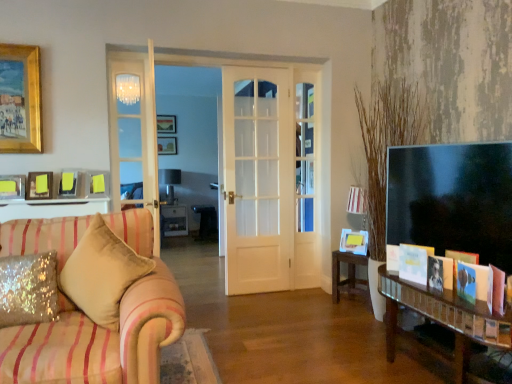
Question: Does matte gold picture frame at upper left, marked as the first picture frame in a front-to-back arrangement, lie behind yellow paper at right, which appears as the 1th picture frame when viewed from the right?

Choices:
 (A) yes
 (B) no

Answer: (B)

Question: Is matte gold picture frame at upper left, which is the first picture frame from left to right, oriented away from yellow paper at right, which is counted as the 1th picture frame, starting from the bottom?

Choices:
 (A) no
 (B) yes

Answer: (A)

Question: Does matte gold picture frame at upper left, which is the first picture frame from left to right, appear on the right side of yellow paper at right, which is counted as the 1th picture frame, starting from the bottom?

Choices:
 (A) yes
 (B) no

Answer: (B)

Question: Considering the relative sizes of matte gold picture frame at upper left, acting as the 6th picture frame starting from the back, and yellow paper at right, which appears as the 1th picture frame when viewed from the right, in the image provided, is matte gold picture frame at upper left, acting as the 6th picture frame starting from the back, shorter than yellow paper at right, which appears as the 1th picture frame when viewed from the right,?

Choices:
 (A) no
 (B) yes

Answer: (B)

Question: Would you say matte gold picture frame at upper left, positioned as the sixth picture frame in right-to-left order, is outside yellow paper at right, which is the 6th picture frame from top to bottom?

Choices:
 (A) yes
 (B) no

Answer: (A)

Question: From a real-world perspective, is matte gold picture frame at upper left, the second picture frame in the bottom-to-top sequence, physically below yellow paper at right, which is counted as the 1th picture frame, starting from the bottom?

Choices:
 (A) no
 (B) yes

Answer: (A)

Question: From a real-world perspective, is matte gold picture frame at upper left, positioned as the sixth picture frame in right-to-left order, on top of white paper card at lower right, which ranks as the 2th book in back-to-front order?

Choices:
 (A) no
 (B) yes

Answer: (B)

Question: Considering the relative sizes of matte gold picture frame at upper left, the second picture frame in the bottom-to-top sequence, and white paper card at lower right, marked as the second book in a front-to-back arrangement, in the image provided, is matte gold picture frame at upper left, the second picture frame in the bottom-to-top sequence, shorter than white paper card at lower right, marked as the second book in a front-to-back arrangement,?

Choices:
 (A) no
 (B) yes

Answer: (B)

Question: From the image's perspective, is matte gold picture frame at upper left, the second picture frame in the bottom-to-top sequence, below white paper card at lower right, marked as the second book in a front-to-back arrangement?

Choices:
 (A) yes
 (B) no

Answer: (B)

Question: Considering the relative positions of matte gold picture frame at upper left, acting as the 6th picture frame starting from the back, and white paper card at lower right, marked as the second book in a front-to-back arrangement, in the image provided, is matte gold picture frame at upper left, acting as the 6th picture frame starting from the back, to the left of white paper card at lower right, marked as the second book in a front-to-back arrangement, from the viewer's perspective?

Choices:
 (A) no
 (B) yes

Answer: (B)

Question: Considering the relative sizes of matte gold picture frame at upper left, the second picture frame in the bottom-to-top sequence, and white paper card at lower right, marked as the second book in a front-to-back arrangement, in the image provided, is matte gold picture frame at upper left, the second picture frame in the bottom-to-top sequence, smaller than white paper card at lower right, marked as the second book in a front-to-back arrangement,?

Choices:
 (A) no
 (B) yes

Answer: (A)

Question: Is matte gold picture frame at upper left, marked as the first picture frame in a front-to-back arrangement, at the right side of white paper card at lower right, which ranks as the 2th book in back-to-front order?

Choices:
 (A) yes
 (B) no

Answer: (B)

Question: Could wooden picture frame at upper center, the fifth picture frame from the front, be considered to be inside metallic silver lamp at center?

Choices:
 (A) no
 (B) yes

Answer: (A)